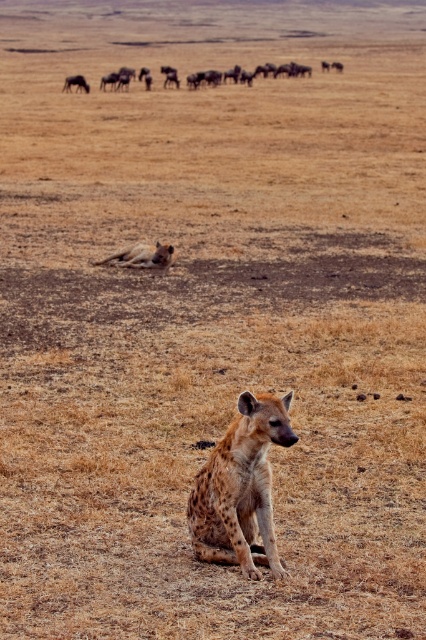
You are observing two points in the savanna scene. The first point is labeled as point (75,84) and the second is point (115,81). Which of these two points is nearer to you?

Point (75,84) is closer to the viewer than point (115,81).

From the picture: You are a wildlife photographer trying to capture a photo of the brown textured herd at upper center. You are currently positioned at the origin point. Which direction should you move to get closer to the herd?

The brown textured herd at upper center is located at point (250,74), so you should move northeast to reach the herd.

You are a wildlife photographer trying to capture a photo of the spotted hyena at upper left in the image. You are standing at the point marked by the coordinates point (75,83). Which direction should you move to get a better shot of the spotted hyena at upper left?

Since the point (75,83) indicates the spotted hyena at upper left, you are already at the location of the hyena. Therefore, you don not need to move to capture its photo.